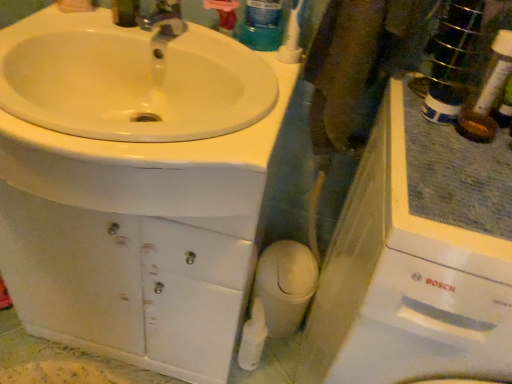
Question: From the image's perspective, is white glossy sink at upper left below white plastic toothbrush at upper right?

Choices:
 (A) yes
 (B) no

Answer: (A)

Question: From the image's perspective, is white glossy sink at upper left over white plastic toothbrush at upper right?

Choices:
 (A) no
 (B) yes

Answer: (A)

Question: Considering the relative sizes of white glossy sink at upper left and white plastic toothbrush at upper right in the image provided, is white glossy sink at upper left taller than white plastic toothbrush at upper right?

Choices:
 (A) no
 (B) yes

Answer: (A)

Question: Considering the relative positions of white glossy sink at upper left and white plastic toothbrush at upper right in the image provided, is white glossy sink at upper left to the left of white plastic toothbrush at upper right from the viewer's perspective?

Choices:
 (A) no
 (B) yes

Answer: (B)

Question: Would you consider white glossy sink at upper left to be distant from white plastic toothbrush at upper right?

Choices:
 (A) no
 (B) yes

Answer: (A)

Question: Is white glossy sink at upper left spatially inside white plastic toothbrush at upper right, or outside of it?

Choices:
 (A) inside
 (B) outside

Answer: (B)

Question: Is white glossy sink at upper left to the left or to the right of white plastic toothbrush at upper right in the image?

Choices:
 (A) right
 (B) left

Answer: (B)

Question: Considering their positions, is white glossy sink at upper left located in front of or behind white plastic toothbrush at upper right?

Choices:
 (A) behind
 (B) front

Answer: (B)

Question: From a real-world perspective, is white glossy sink at upper left physically located above or below white plastic toothbrush at upper right?

Choices:
 (A) below
 (B) above

Answer: (A)

Question: Considering the positions of translucent plastic mouthwash at upper center and white plastic toothbrush at upper right in the image, is translucent plastic mouthwash at upper center wider or thinner than white plastic toothbrush at upper right?

Choices:
 (A) wide
 (B) thin

Answer: (A)

Question: Which is correct: translucent plastic mouthwash at upper center is inside white plastic toothbrush at upper right, or outside of it?

Choices:
 (A) outside
 (B) inside

Answer: (A)

Question: Relative to white plastic toothbrush at upper right, is translucent plastic mouthwash at upper center in front or behind?

Choices:
 (A) front
 (B) behind

Answer: (B)

Question: From a real-world perspective, relative to white plastic toothbrush at upper right, is translucent plastic mouthwash at upper center vertically above or below?

Choices:
 (A) below
 (B) above

Answer: (B)

Question: From a real-world perspective, is white plastic toothbrush at upper right above or below translucent plastic mouthwash at upper center?

Choices:
 (A) below
 (B) above

Answer: (A)

Question: Would you say white plastic toothbrush at upper right is to the left or to the right of translucent plastic mouthwash at upper center in the picture?

Choices:
 (A) left
 (B) right

Answer: (B)